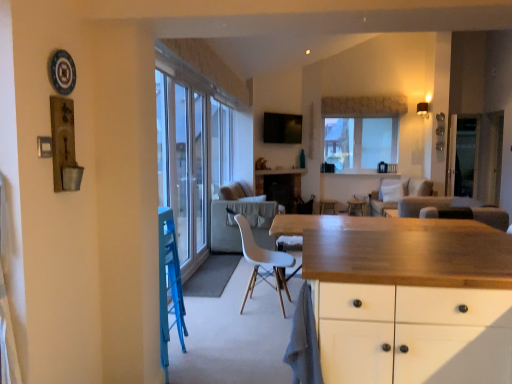
Question: Is beige fabric couch at center, the first couch positioned from the back, aimed at wooden countertop at center?

Choices:
 (A) no
 (B) yes

Answer: (B)

Question: Is the depth of beige fabric couch at center, the first couch positioned from the back, greater than that of wooden countertop at center?

Choices:
 (A) yes
 (B) no

Answer: (B)

Question: Is beige fabric couch at center, positioned as the second couch in front-to-back order, not within wooden countertop at center?

Choices:
 (A) no
 (B) yes

Answer: (B)

Question: Is beige fabric couch at center, positioned as the second couch in front-to-back order, bigger than wooden countertop at center?

Choices:
 (A) yes
 (B) no

Answer: (A)

Question: Is beige fabric couch at center, the first couch positioned from the back, smaller than wooden countertop at center?

Choices:
 (A) no
 (B) yes

Answer: (A)

Question: From a real-world perspective, is beige fabric couch at center, positioned as the second couch in front-to-back order, on wooden countertop at center?

Choices:
 (A) no
 (B) yes

Answer: (A)

Question: Considering the relative sizes of wooden countertop at center and wooden table at center in the image provided, is wooden countertop at center shorter than wooden table at center?

Choices:
 (A) no
 (B) yes

Answer: (A)

Question: Is wooden countertop at center thinner than wooden table at center?

Choices:
 (A) yes
 (B) no

Answer: (B)

Question: Could you tell me if wooden countertop at center is facing wooden table at center?

Choices:
 (A) yes
 (B) no

Answer: (B)

Question: From a real-world perspective, is wooden countertop at center beneath wooden table at center?

Choices:
 (A) yes
 (B) no

Answer: (B)

Question: Does wooden countertop at center lie behind wooden table at center?

Choices:
 (A) no
 (B) yes

Answer: (A)

Question: From a real-world perspective, is wooden countertop at center positioned over wooden table at center based on gravity?

Choices:
 (A) no
 (B) yes

Answer: (B)

Question: Considering the relative sizes of transparent glass door at right and beige fabric couch at center, the first couch positioned from the back, in the image provided, is transparent glass door at right bigger than beige fabric couch at center, the first couch positioned from the back,?

Choices:
 (A) yes
 (B) no

Answer: (B)